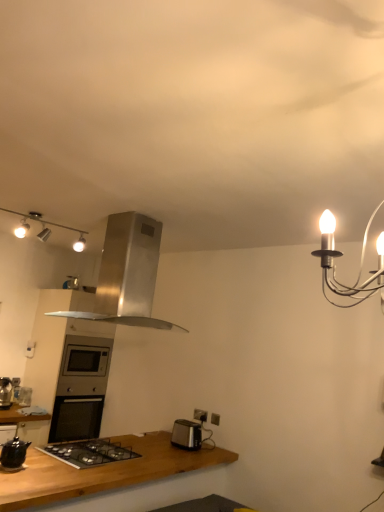
At what (x,y) coordinates should I click in order to perform the action: click on spots to the right of matte black kettle at lower left. Please return your answer as a coordinate pair (x, y). The width and height of the screenshot is (384, 512). Looking at the image, I should click on (43, 469).